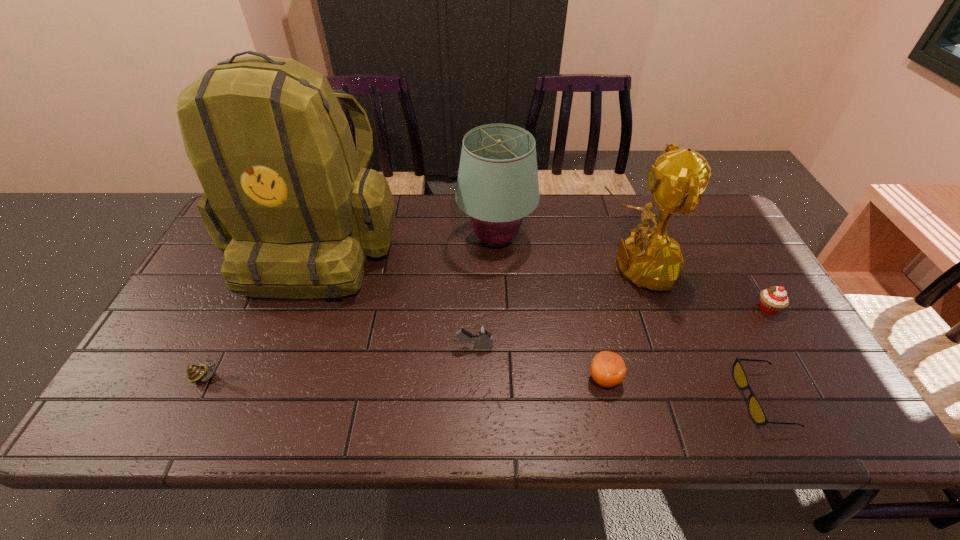
Locate an element on the screen. free space located on the front-facing side of the sunglasses is located at coordinates (661, 399).

Find the location of a particular element. The image size is (960, 540). backpack that is positioned at the far edge is located at coordinates (287, 198).

Where is `award positioned at the far edge`? award positioned at the far edge is located at coordinates (650, 258).

The height and width of the screenshot is (540, 960). In order to click on lampshade at the far edge in this screenshot , I will do click(497, 185).

What are the coordinates of `object that is at the near edge` in the screenshot? It's located at (757, 413).

The image size is (960, 540). Identify the location of backpack that is at the left edge. (287, 198).

Find the location of a particular element. This screenshot has width=960, height=540. snail located in the left edge section of the desktop is located at coordinates pyautogui.click(x=195, y=373).

Image resolution: width=960 pixels, height=540 pixels. In order to click on cupcake at the right edge in this screenshot , I will do `click(772, 300)`.

Where is `sunglasses situated at the right edge`? The width and height of the screenshot is (960, 540). sunglasses situated at the right edge is located at coordinates (757, 413).

The width and height of the screenshot is (960, 540). Find the location of `object that is at the far left corner`. object that is at the far left corner is located at coordinates (287, 198).